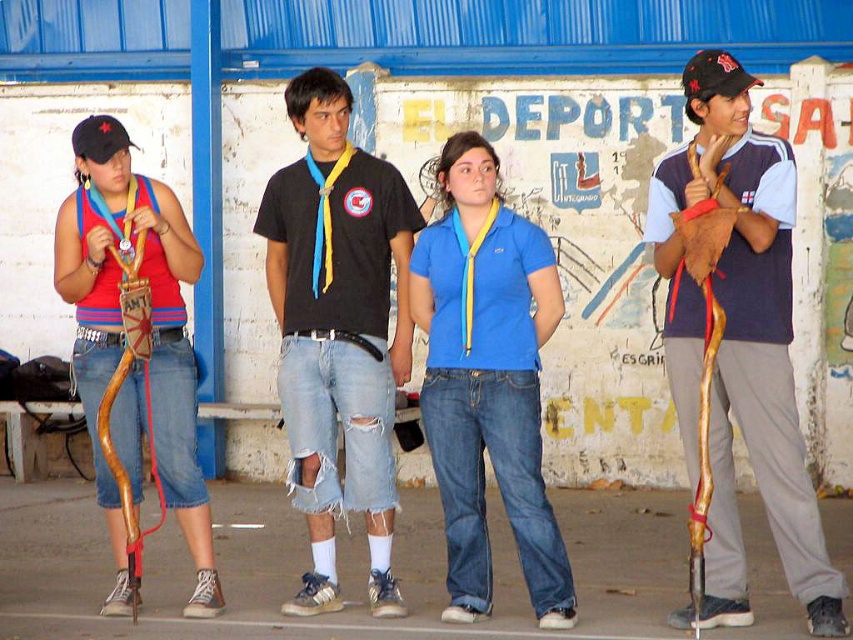
Which is behind, point (285, 214) or point (532, 321)?

Positioned behind is point (285, 214).

Which is in front, point (291, 205) or point (543, 236)?

Point (543, 236) is more forward.

I want to click on black cotton t-shirt at center, so click(338, 332).

Who is positioned more to the left, blue cotton shirt at center or matte brown wooden bow at left?

Positioned to the left is matte brown wooden bow at left.

What do you see at coordinates (486, 380) in the screenshot?
I see `blue cotton shirt at center` at bounding box center [486, 380].

Between point (490, 195) and point (123, 248), which one is positioned behind?

The point (123, 248) is behind.

This screenshot has height=640, width=853. I want to click on blue cotton shirt at center, so click(486, 380).

From the picture: Is black cotton t-shirt at center to the right of matte brown wooden bow at left from the viewer's perspective?

Correct, you'll find black cotton t-shirt at center to the right of matte brown wooden bow at left.

Is point (337, 476) positioned after point (73, 236)?

Yes, point (337, 476) is behind point (73, 236).

The width and height of the screenshot is (853, 640). I want to click on black cotton t-shirt at center, so click(338, 332).